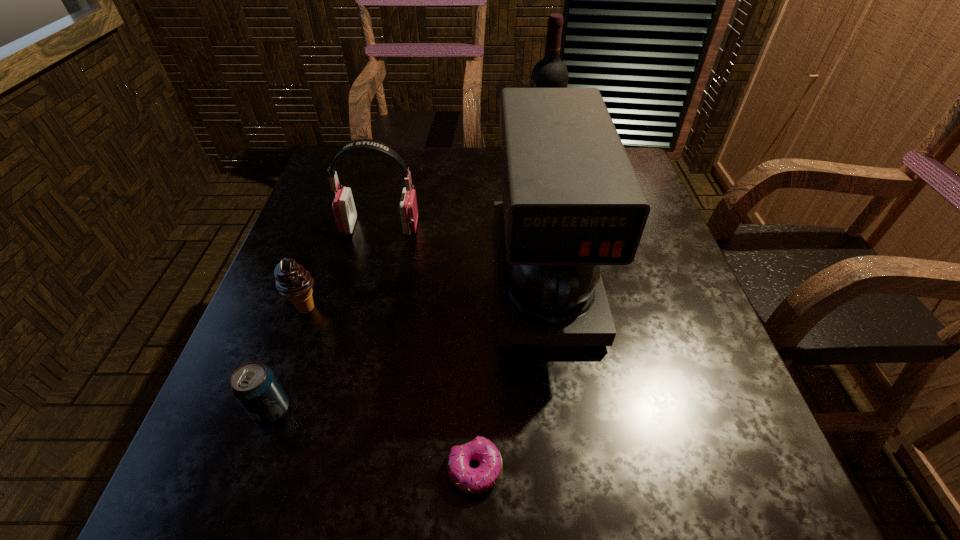
This screenshot has width=960, height=540. I want to click on free space between the third object from right to left and the fourth shortest object, so (427, 348).

The height and width of the screenshot is (540, 960). What are the coordinates of `free space between the fifth shortest object and the shortest object` in the screenshot? It's located at (509, 372).

The height and width of the screenshot is (540, 960). I want to click on free area in between the icecream and the third object from right to left, so click(390, 389).

Find the location of a particular element. This screenshot has height=540, width=960. free space between the coffee maker and the fourth shortest object is located at coordinates (462, 250).

Identify the location of vacant space that's between the fifth farthest object and the third shortest object. Image resolution: width=960 pixels, height=540 pixels. (289, 360).

Where is `free space between the farthest object and the second nearest object`? free space between the farthest object and the second nearest object is located at coordinates (406, 285).

What are the coordinates of `object that is the closest to the second shortest object` in the screenshot? It's located at (292, 281).

Select which object appears as the second closest to the fifth farthest object. Please provide its 2D coordinates. Your answer should be formatted as a tuple, i.e. [(x, y)], where the tuple contains the x and y coordinates of a point satisfying the conditions above.

[(469, 480)]

I want to click on vacant space that satisfies the following two spatial constraints: 1. on the front side of the pop soda; 2. on the right side of the doughnut, so click(x=252, y=469).